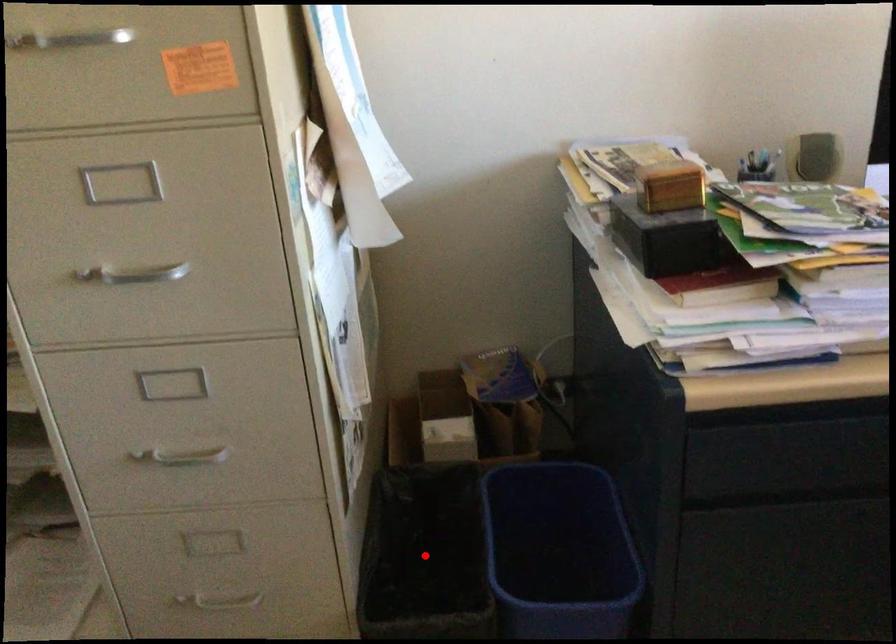
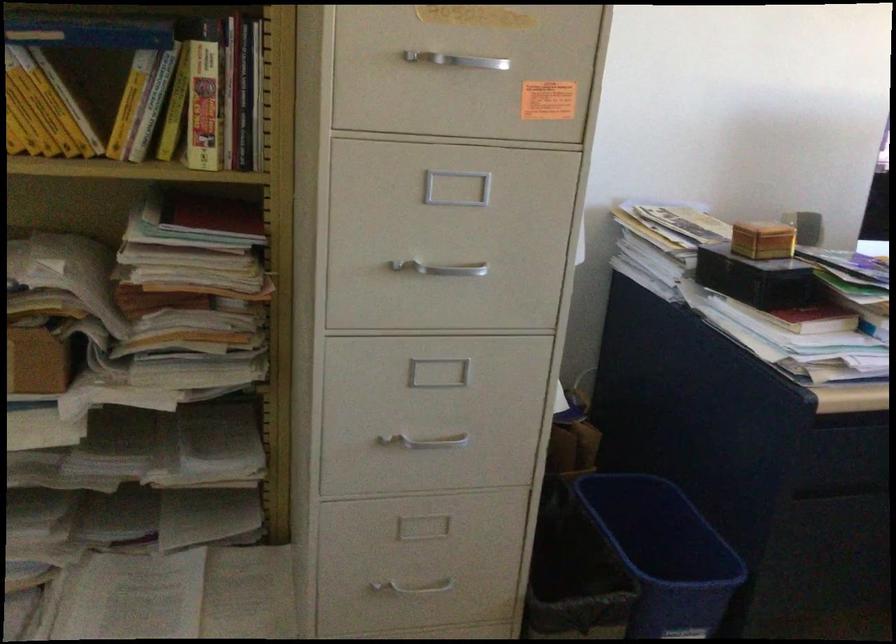
Question: I am providing you with two images of the same scene from different viewpoints. A red point is marked on the first image. Can you still see the location of the red point in image 2?

Choices:
 (A) Yes
 (B) No

Answer: (B)